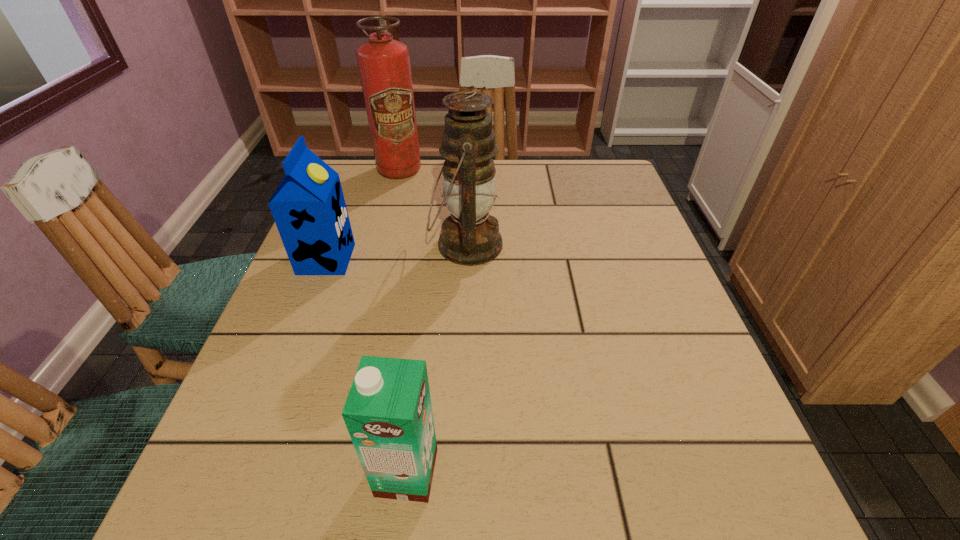
Where is `vacant space that satisfies the following two spatial constraints: 1. with the cap open on the nearer carton; 2. on the right side of the farther carton`? vacant space that satisfies the following two spatial constraints: 1. with the cap open on the nearer carton; 2. on the right side of the farther carton is located at coordinates (243, 472).